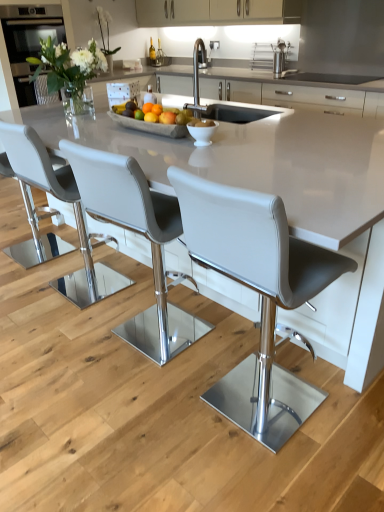
Where is `vacant space situated on the left part of white leather stool at center, marked as the third chair in a left-to-right arrangement`? The image size is (384, 512). vacant space situated on the left part of white leather stool at center, marked as the third chair in a left-to-right arrangement is located at coordinates (72, 346).